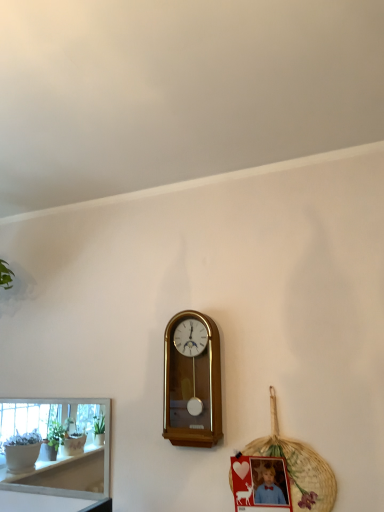
Question: Is woven straw basket at lower right far away from matte plastic picture frame at lower right?

Choices:
 (A) no
 (B) yes

Answer: (A)

Question: Can you confirm if woven straw basket at lower right is shorter than matte plastic picture frame at lower right?

Choices:
 (A) no
 (B) yes

Answer: (A)

Question: Is woven straw basket at lower right completely or partially outside of matte plastic picture frame at lower right?

Choices:
 (A) no
 (B) yes

Answer: (B)

Question: Is woven straw basket at lower right taller than matte plastic picture frame at lower right?

Choices:
 (A) yes
 (B) no

Answer: (A)

Question: Is woven straw basket at lower right at the left side of matte plastic picture frame at lower right?

Choices:
 (A) no
 (B) yes

Answer: (A)

Question: Is woven straw basket at lower right turned away from matte plastic picture frame at lower right?

Choices:
 (A) no
 (B) yes

Answer: (B)

Question: Considering the relative positions of matte plastic picture frame at lower right and white glossy shelf at lower left in the image provided, is matte plastic picture frame at lower right to the right of white glossy shelf at lower left from the viewer's perspective?

Choices:
 (A) yes
 (B) no

Answer: (A)

Question: Does matte plastic picture frame at lower right have a greater width compared to white glossy shelf at lower left?

Choices:
 (A) yes
 (B) no

Answer: (A)

Question: Is matte plastic picture frame at lower right outside of white glossy shelf at lower left?

Choices:
 (A) no
 (B) yes

Answer: (B)

Question: Considering the relative sizes of matte plastic picture frame at lower right and white glossy shelf at lower left in the image provided, is matte plastic picture frame at lower right bigger than white glossy shelf at lower left?

Choices:
 (A) yes
 (B) no

Answer: (B)

Question: Is matte plastic picture frame at lower right smaller than white glossy shelf at lower left?

Choices:
 (A) no
 (B) yes

Answer: (B)

Question: Is matte plastic picture frame at lower right in contact with white glossy shelf at lower left?

Choices:
 (A) yes
 (B) no

Answer: (B)

Question: From the image's perspective, would you say wooden wall clock at center is shown under matte plastic picture frame at lower right?

Choices:
 (A) no
 (B) yes

Answer: (A)